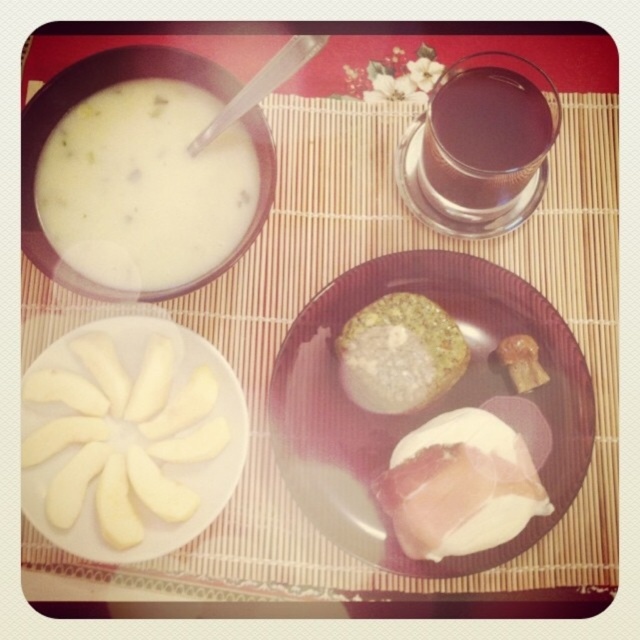
You are a food critic evaluating portion sizes. Given the scene described, which item has a smaller portion size between the white creamy soup at upper left and the white smooth apple slices at center left?

The white creamy soup at upper left has a smaller size compared to the white smooth apple slices at center left, so the soup has a smaller portion size.

From the picture: You are a food critic evaluating the meal setup. Based on the description, which item is taller between the white smooth apple slices at center left and the golden crispy pastry at center?

The white smooth apple slices at center left are taller than the golden crispy pastry at center.